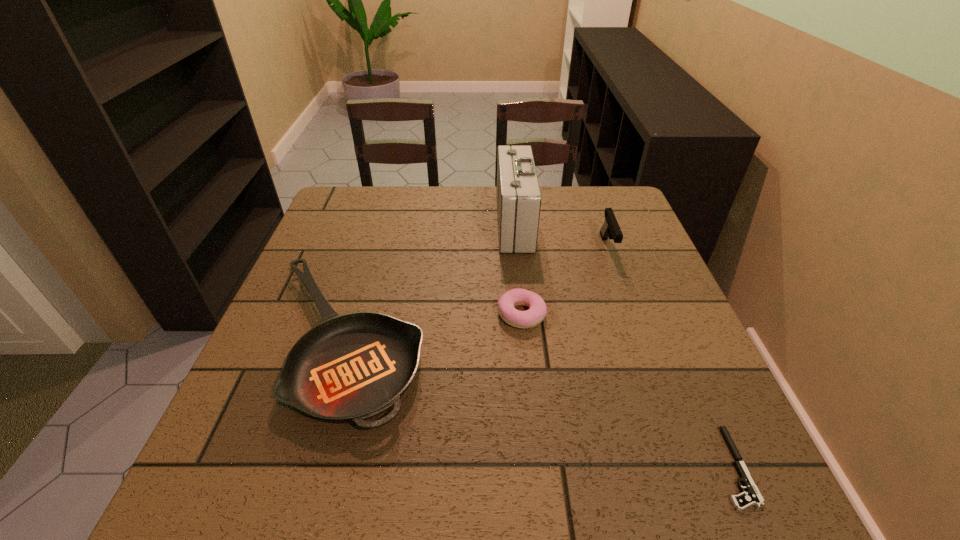
What are the coordinates of `blank area located on the front-facing side of the left pistol` in the screenshot? It's located at (634, 321).

You are a GUI agent. You are given a task and a screenshot of the screen. Output one action in this format:
    pyautogui.click(x=<x>, y=<y>)
    Task: Click on the blank space located on the right of the leftmost object
    The image size is (960, 540).
    Given the screenshot: What is the action you would take?
    pyautogui.click(x=535, y=340)

You are a GUI agent. You are given a task and a screenshot of the screen. Output one action in this format:
    pyautogui.click(x=<x>, y=<y>)
    Task: Click on the vacant space situated on the back of the pastry
    
    Given the screenshot: What is the action you would take?
    pyautogui.click(x=511, y=212)

The height and width of the screenshot is (540, 960). Find the location of `vacant space situated on the front-facing side of the shortest object`. vacant space situated on the front-facing side of the shortest object is located at coordinates (510, 467).

At what (x,y) coordinates should I click in order to perform the action: click on vacant area situated 0.150m on the front-facing side of the shortest object. Please return your answer as a coordinate pair (x, y). Looking at the image, I should click on (625, 467).

I want to click on free space located 0.390m on the front-facing side of the shortest object, so click(x=480, y=467).

This screenshot has width=960, height=540. Identify the location of object that is at the far edge. (518, 196).

The width and height of the screenshot is (960, 540). Identify the location of object present at the near edge. (752, 496).

Where is `object at the left edge`? The image size is (960, 540). object at the left edge is located at coordinates (352, 367).

At what (x,y) coordinates should I click in order to perform the action: click on object that is at the near right corner. Please return your answer as a coordinate pair (x, y). Looking at the image, I should click on (752, 496).